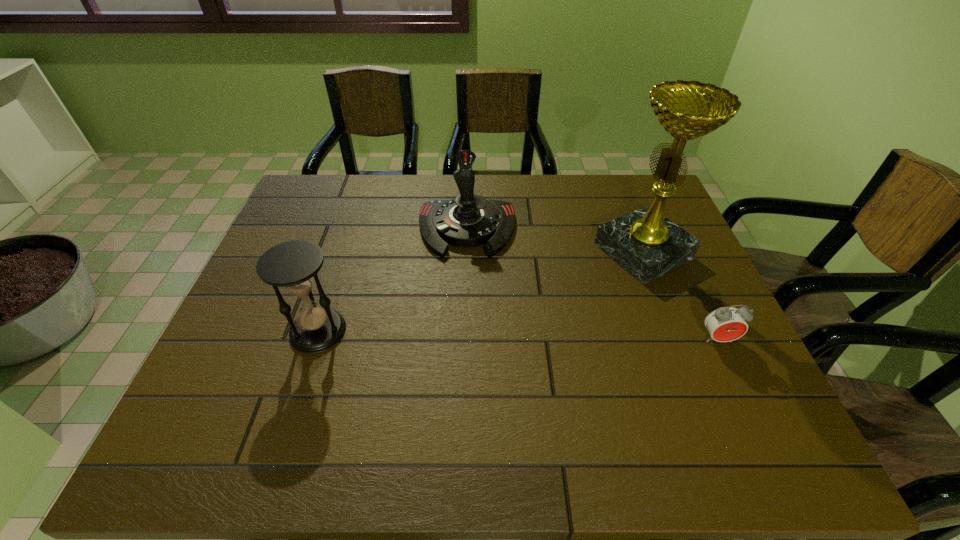
Image resolution: width=960 pixels, height=540 pixels. Find the location of `vacant area between the leftmost object and the award`. vacant area between the leftmost object and the award is located at coordinates (481, 291).

In order to click on vacant space that's between the second object from left to right and the leftmost object in this screenshot , I will do `click(393, 280)`.

Identify the location of free space between the third object from right to left and the award. (555, 240).

This screenshot has height=540, width=960. What are the coordinates of `vacant area that lies between the hourglass and the second object from left to right` in the screenshot? It's located at (393, 280).

Locate an element on the screen. The width and height of the screenshot is (960, 540). free space between the second object from left to right and the tallest object is located at coordinates (555, 240).

Image resolution: width=960 pixels, height=540 pixels. I want to click on free spot between the second object from left to right and the hourglass, so click(x=393, y=280).

The image size is (960, 540). Find the location of `vacant region between the hourglass and the award`. vacant region between the hourglass and the award is located at coordinates (481, 291).

The width and height of the screenshot is (960, 540). Find the location of `empty space that is in between the alarm clock and the award`. empty space that is in between the alarm clock and the award is located at coordinates (681, 295).

Locate an element on the screen. free space between the hourglass and the shortest object is located at coordinates (517, 335).

The width and height of the screenshot is (960, 540). Find the location of `free space between the hourglass and the award`. free space between the hourglass and the award is located at coordinates (481, 291).